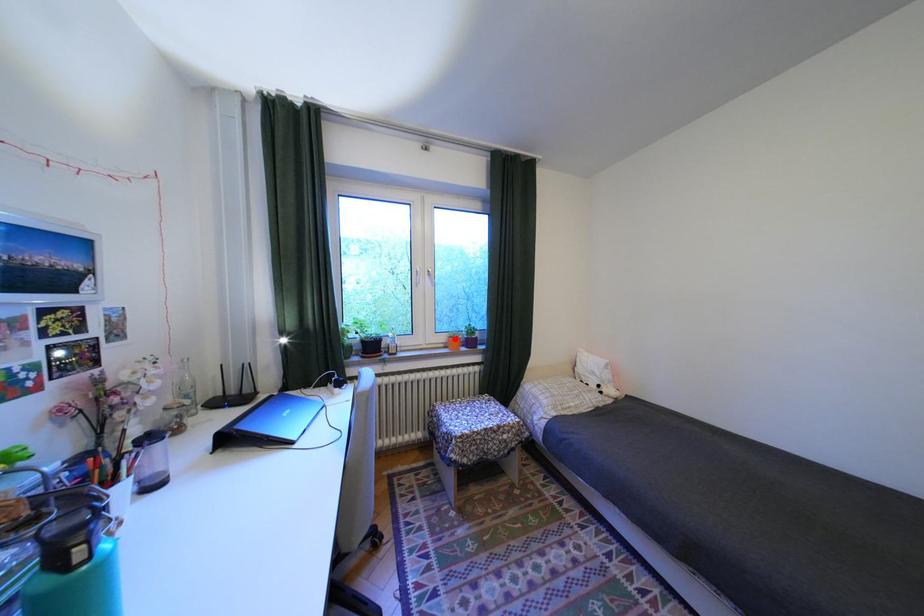
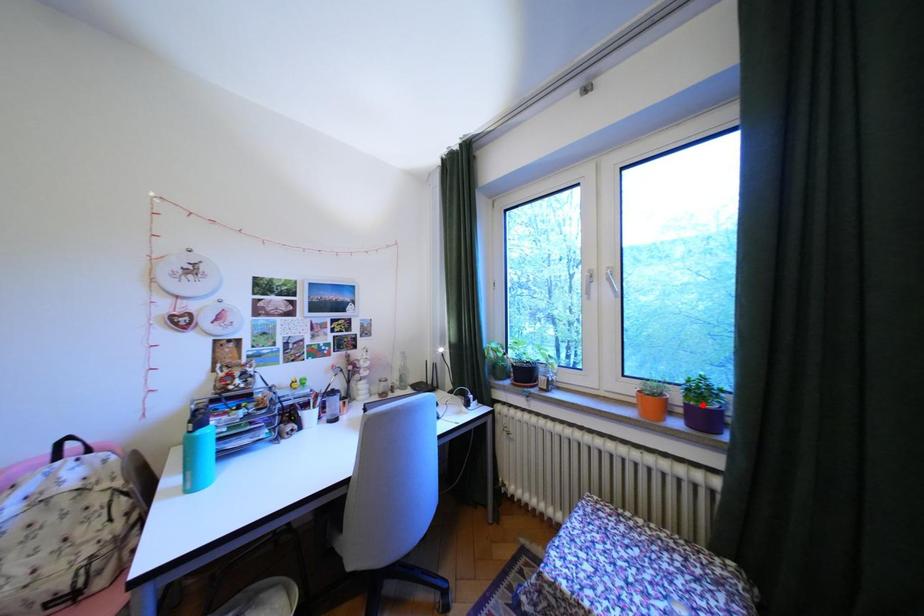
I am providing you with two images of the same scene from different viewpoints. A red point is marked on the first image and another point is marked on the second image. Does the point marked in image1 correspond to the same location as the one in image2?

No